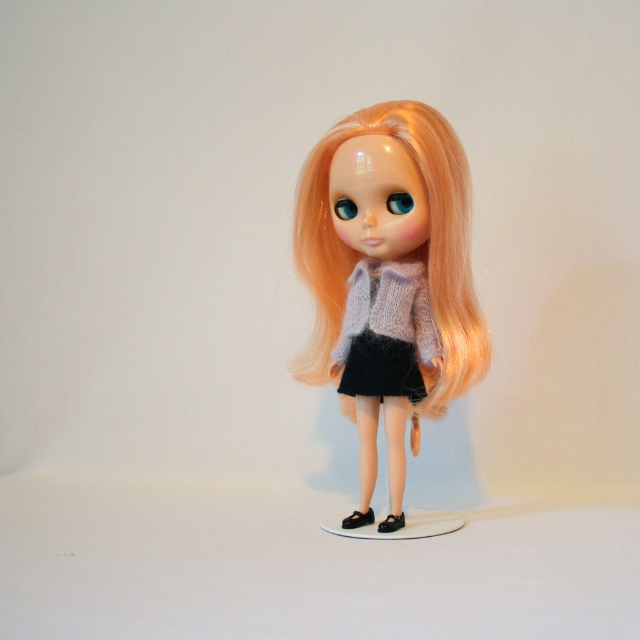
Consider the image. You are a fashion designer trying to create a new outfit for a doll. You have two options for the top part of the outfit. The first option is the matte purple sweater at center, and the second option is the black knitted dress at center. Which top option would you choose if you want the top to be more prominent and stand out visually?

The matte purple sweater at center is larger in size than the black knitted dress at center, so choosing the matte purple sweater at center would make the top more prominent and stand out visually.

You are a photographer taking a closeup shot of the doll. You notice two points on the doll, point (x=316, y=166) and point (x=410, y=400). Which point is closer to the camera?

Point (x=316, y=166) is further to the camera than point (x=410, y=400), so point (x=316, y=166) is closer to the camera.

You are an artist trying to sketch the doll. You want to place the matte purple sweater at center in your drawing. Where should you position it according to the coordinates provided?

The matte purple sweater at center should be positioned at coordinates point (388,276).